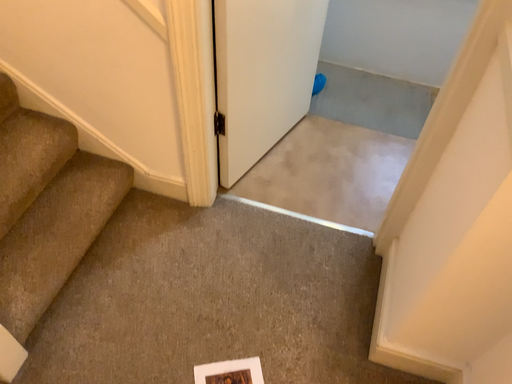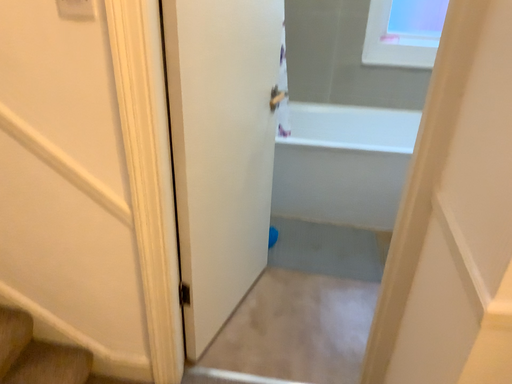
Question: How did the camera likely rotate when shooting the video?

Choices:
 (A) rotated upward
 (B) rotated downward

Answer: (A)